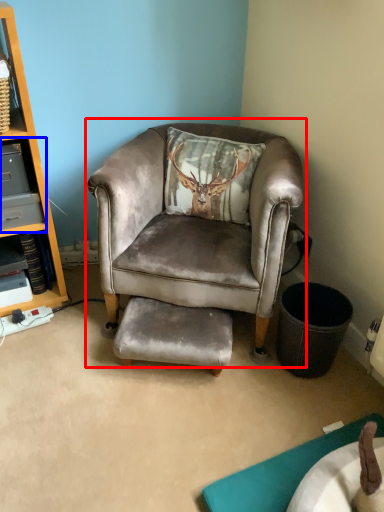
Question: Which point is closer to the camera, chair (highlighted by a red box) or shelf (highlighted by a blue box)?

Choices:
 (A) chair
 (B) shelf

Answer: (A)